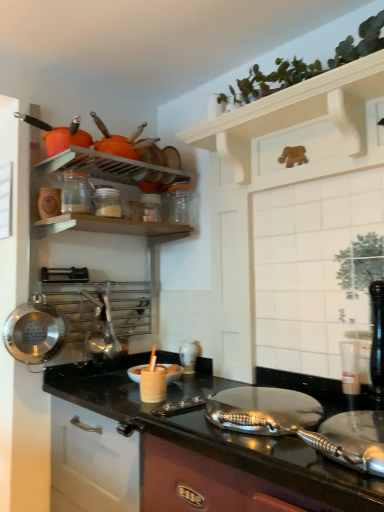
Question: Is polished stainless steel wok at left smaller than clear glass jar at upper center, positioned as the 2th appliance in front-to-back order?

Choices:
 (A) yes
 (B) no

Answer: (B)

Question: Is polished stainless steel wok at left oriented towards clear glass jar at upper center, acting as the 2th appliance starting from the right?

Choices:
 (A) no
 (B) yes

Answer: (A)

Question: Is clear glass jar at upper center, which is counted as the second appliance, starting from the left, completely or partially inside polished stainless steel wok at left?

Choices:
 (A) yes
 (B) no

Answer: (B)

Question: Is polished stainless steel wok at left taller than clear glass jar at upper center, which is the 2th appliance in top-to-bottom order?

Choices:
 (A) no
 (B) yes

Answer: (B)

Question: Are polished stainless steel wok at left and clear glass jar at upper center, which is the 2th appliance in bottom-to-top order, located far from each other?

Choices:
 (A) no
 (B) yes

Answer: (A)

Question: Is polished stainless steel wok at left looking in the opposite direction of clear glass jar at upper center, which is the 2th appliance in top-to-bottom order?

Choices:
 (A) no
 (B) yes

Answer: (A)

Question: Can you confirm if white wooden shelf at upper center is wider than metallic black countertop at center?

Choices:
 (A) no
 (B) yes

Answer: (A)

Question: From the image's perspective, is white wooden shelf at upper center on metallic black countertop at center?

Choices:
 (A) no
 (B) yes

Answer: (B)

Question: Is metallic black countertop at center at the back of white wooden shelf at upper center?

Choices:
 (A) no
 (B) yes

Answer: (A)

Question: Can you confirm if white wooden shelf at upper center is taller than metallic black countertop at center?

Choices:
 (A) no
 (B) yes

Answer: (A)

Question: Is white wooden shelf at upper center shorter than metallic black countertop at center?

Choices:
 (A) no
 (B) yes

Answer: (B)

Question: Does white wooden shelf at upper center lie in front of metallic black countertop at center?

Choices:
 (A) yes
 (B) no

Answer: (B)

Question: Can you confirm if white glossy vase at center, the 3th appliance from the top, is wider than white wooden shelf at upper center?

Choices:
 (A) yes
 (B) no

Answer: (B)